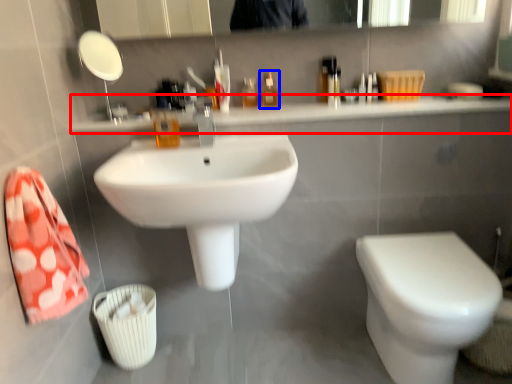
Question: Which of the following is the farthest to the observer, counter top (highlighted by a red box) or mouthwash (highlighted by a blue box)?

Choices:
 (A) counter top
 (B) mouthwash

Answer: (B)